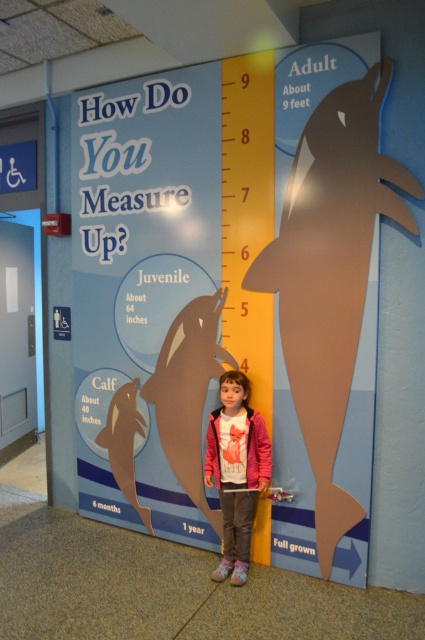
Question: Considering the relative positions of yellow matte ruler at center and pink fleece jacket at center in the image provided, where is yellow matte ruler at center located with respect to pink fleece jacket at center?

Choices:
 (A) below
 (B) above

Answer: (B)

Question: Does yellow matte ruler at center appear on the right side of pink fleece jacket at center?

Choices:
 (A) no
 (B) yes

Answer: (B)

Question: Is yellow matte ruler at center further to the viewer compared to pink fleece jacket at center?

Choices:
 (A) yes
 (B) no

Answer: (A)

Question: Which point is closer to the camera?

Choices:
 (A) (255, 477)
 (B) (241, 272)

Answer: (A)